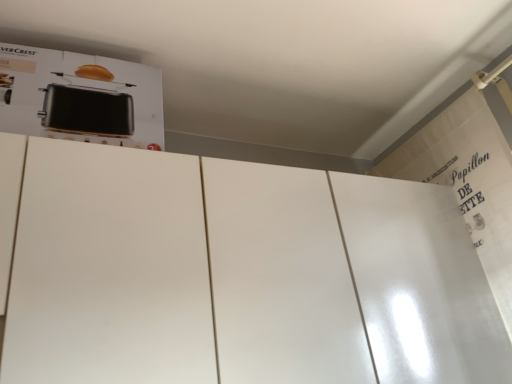
Question: Should I look upward or downward to see white glossy door at upper right?

Choices:
 (A) down
 (B) up

Answer: (A)

Question: From a real-world perspective, is white glossy door at upper right beneath black metallic toaster at upper left?

Choices:
 (A) yes
 (B) no

Answer: (A)

Question: Are white glossy door at upper right and black metallic toaster at upper left beside each other?

Choices:
 (A) no
 (B) yes

Answer: (A)

Question: Considering the relative sizes of white glossy door at upper right and black metallic toaster at upper left in the image provided, is white glossy door at upper right bigger than black metallic toaster at upper left?

Choices:
 (A) no
 (B) yes

Answer: (B)

Question: Are white glossy door at upper right and black metallic toaster at upper left located far from each other?

Choices:
 (A) yes
 (B) no

Answer: (B)

Question: From the image's perspective, is white glossy door at upper right on black metallic toaster at upper left?

Choices:
 (A) no
 (B) yes

Answer: (A)

Question: Is the position of white glossy door at upper right less distant than that of black metallic toaster at upper left?

Choices:
 (A) no
 (B) yes

Answer: (A)

Question: Is white glossy door at upper right at the back of black metallic toaster at upper left?

Choices:
 (A) no
 (B) yes

Answer: (A)

Question: Is black metallic toaster at upper left to the left of white glossy door at upper right from the viewer's perspective?

Choices:
 (A) yes
 (B) no

Answer: (A)

Question: Does black metallic toaster at upper left have a larger size compared to white glossy door at upper right?

Choices:
 (A) no
 (B) yes

Answer: (A)

Question: Considering the relative sizes of black metallic toaster at upper left and white glossy door at upper right in the image provided, is black metallic toaster at upper left thinner than white glossy door at upper right?

Choices:
 (A) yes
 (B) no

Answer: (B)

Question: Is black metallic toaster at upper left closer to camera compared to white glossy door at upper right?

Choices:
 (A) no
 (B) yes

Answer: (B)

Question: Is black metallic toaster at upper left next to white glossy door at upper right?

Choices:
 (A) no
 (B) yes

Answer: (A)

Question: Based on their positions, is white glossy door at upper right located to the left or right of black metallic toaster at upper left?

Choices:
 (A) left
 (B) right

Answer: (B)